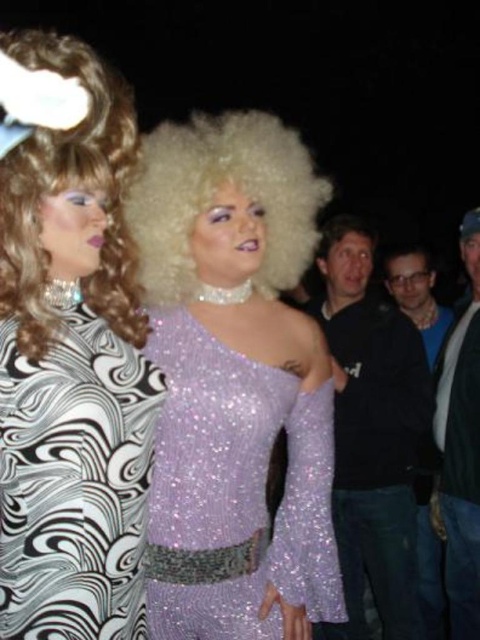
Question: Which object appears farthest from the camera in this image?

Choices:
 (A) denim jacket at right
 (B) dark blue shirt at right

Answer: (B)

Question: Is sparkly purple sweater at center bigger than black and white patterned dress at left?

Choices:
 (A) no
 (B) yes

Answer: (B)

Question: Is denim jacket at right to the left of dark blue sweater at right from the viewer's perspective?

Choices:
 (A) yes
 (B) no

Answer: (B)

Question: Considering the real-world distances, which object is closest to the curly blonde wig at upper left?

Choices:
 (A) black and white patterned dress at left
 (B) sparkly purple sweater at center
 (C) dark blue sweater at right
 (D) blue shirt at right

Answer: (A)

Question: Which object is positioned farthest from the denim jacket at right?

Choices:
 (A) blue shirt at right
 (B) dark blue sweater at right

Answer: (B)

Question: Where is black and white patterned dress at left located in relation to blue shirt at right in the image?

Choices:
 (A) left
 (B) right

Answer: (A)